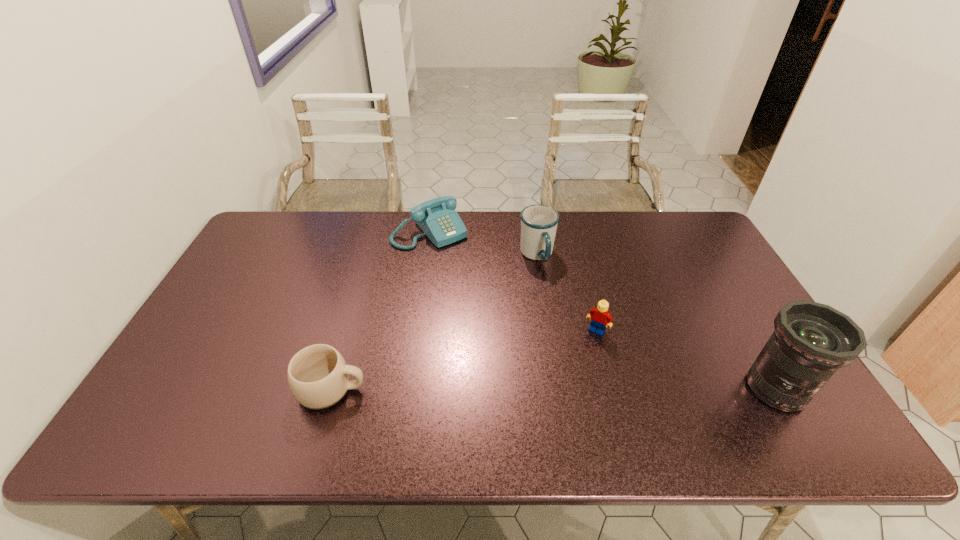
Image resolution: width=960 pixels, height=540 pixels. Find the location of `the nearer mug`. the nearer mug is located at coordinates (318, 376).

Locate an element on the screen. The width and height of the screenshot is (960, 540). the shorter mug is located at coordinates (318, 376).

At what (x,y) coordinates should I click in order to perform the action: click on the rightmost object. Please return your answer as a coordinate pair (x, y). The width and height of the screenshot is (960, 540). Looking at the image, I should click on (811, 341).

The image size is (960, 540). I want to click on telephoto lens, so click(x=811, y=341).

At what (x,y) coordinates should I click in order to perform the action: click on the third farthest object. Please return your answer as a coordinate pair (x, y). Image resolution: width=960 pixels, height=540 pixels. Looking at the image, I should click on 599,316.

At what (x,y) coordinates should I click in order to perform the action: click on Lego. Please return your answer as a coordinate pair (x, y). This screenshot has width=960, height=540. Looking at the image, I should click on (599, 316).

Find the location of a particular element. The image size is (960, 540). the second tallest object is located at coordinates (539, 223).

At what (x,y) coordinates should I click in order to perform the action: click on the farther mug. Please return your answer as a coordinate pair (x, y). Looking at the image, I should click on (539, 223).

The height and width of the screenshot is (540, 960). In order to click on telephone in this screenshot , I will do `click(437, 218)`.

Identify the location of free spot located 0.190m on the side of the left mug with the handle. pos(444,389).